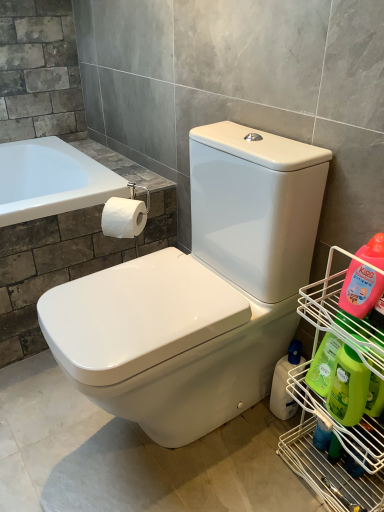
Identify the location of white matte toilet paper at upper left. This screenshot has height=512, width=384. (123, 217).

What do you see at coordinates (285, 382) in the screenshot? I see `translucent plastic bottle at lower right, which is the 1th cleaning product in back-to-front order` at bounding box center [285, 382].

Measure the distance between green plastic bottle at right, arranged as the third cleaning product when viewed from the front, and camera.

green plastic bottle at right, arranged as the third cleaning product when viewed from the front, and camera are 35.65 inches apart.

You are a GUI agent. You are given a task and a screenshot of the screen. Output one action in this format:
    pyautogui.click(x=<x>, y=<y>)
    Task: Click on the pink plastic bottle at right, the fourth cleaning product positioned from the back
    Image resolution: width=384 pixels, height=512 pixels.
    Given the screenshot: What is the action you would take?
    pyautogui.click(x=360, y=289)

Find the location of `metal wire rack at right`. metal wire rack at right is located at coordinates (326, 456).

Locate an element on the screen. This screenshot has height=512, width=384. green matte bottle at lower right, which is counted as the 2th cleaning product, starting from the front is located at coordinates (348, 387).

From the picture: Who is shorter, green matte bottle at lower right, the 3th cleaning product positioned from the back, or white matte toilet paper at upper left?

With less height is white matte toilet paper at upper left.

Which of these two, green matte bottle at lower right, which is counted as the 2th cleaning product, starting from the front, or white matte toilet paper at upper left, is wider?

Wider between the two is white matte toilet paper at upper left.

Which is more to the left, green matte bottle at lower right, which is counted as the 2th cleaning product, starting from the front, or white matte toilet paper at upper left?

From the viewer's perspective, white matte toilet paper at upper left appears more on the left side.

From a real-world perspective, does green matte bottle at lower right, which is counted as the 2th cleaning product, starting from the front, sit lower than white matte toilet paper at upper left?

Yes, from a real-world perspective, green matte bottle at lower right, which is counted as the 2th cleaning product, starting from the front, is below white matte toilet paper at upper left.

From the image's perspective, relative to white matte toilet paper at upper left, is translucent plastic bottle at lower right, the 4th cleaning product from the front, above or below?

translucent plastic bottle at lower right, the 4th cleaning product from the front, is situated lower than white matte toilet paper at upper left in the image.

From a real-world perspective, which is physically above, translucent plastic bottle at lower right, the 4th cleaning product from the front, or white matte toilet paper at upper left?

From a 3D spatial view, white matte toilet paper at upper left is above.

Is white matte toilet paper at upper left a part of translucent plastic bottle at lower right, which is the 1th cleaning product in back-to-front order?

That's incorrect, white matte toilet paper at upper left is not inside translucent plastic bottle at lower right, which is the 1th cleaning product in back-to-front order.

Are translucent plastic bottle at lower right, which is the 1th cleaning product in back-to-front order, and white matte toilet paper at upper left far apart?

Actually, translucent plastic bottle at lower right, which is the 1th cleaning product in back-to-front order, and white matte toilet paper at upper left are a little close together.

What's the angular difference between green matte bottle at lower right, which is counted as the 2th cleaning product, starting from the front, and pink plastic bottle at right, acting as the 1th cleaning product starting from the front,'s facing directions?

3.24 degrees.

Which is closer to the camera, [363,385] or [351,307]?

Clearly, point [363,385] is closer to the camera than point [351,307].

Measure the distance between green matte bottle at lower right, the 3th cleaning product positioned from the back, and pink plastic bottle at right, the fourth cleaning product positioned from the back.

green matte bottle at lower right, the 3th cleaning product positioned from the back, and pink plastic bottle at right, the fourth cleaning product positioned from the back, are 16.16 centimeters apart.

Consider the image. Relative to pink plastic bottle at right, the fourth cleaning product positioned from the back, is green matte bottle at lower right, the 3th cleaning product positioned from the back, in front or behind?

In the image, green matte bottle at lower right, the 3th cleaning product positioned from the back, appears behind pink plastic bottle at right, the fourth cleaning product positioned from the back.

What's the angular difference between metal wire rack at right and green plastic bottle at right, arranged as the third cleaning product when viewed from the front,'s facing directions?

They differ by 0.923 degrees in their facing directions.

Is metal wire rack at right at the right side of green plastic bottle at right, arranged as the third cleaning product when viewed from the front?

Yes, metal wire rack at right is to the right of green plastic bottle at right, arranged as the third cleaning product when viewed from the front.

The height and width of the screenshot is (512, 384). Find the location of `shelf lying in front of the green plastic bottle at right, arranged as the third cleaning product when viewed from the front`. shelf lying in front of the green plastic bottle at right, arranged as the third cleaning product when viewed from the front is located at coordinates (326, 456).

Is metal wire rack at right bigger than green plastic bottle at right, arranged as the third cleaning product when viewed from the front?

Yes.

Where is `cleaning product above the green plastic bottle at right, arranged as the third cleaning product when viewed from the front (from the image's perspective)`? The width and height of the screenshot is (384, 512). cleaning product above the green plastic bottle at right, arranged as the third cleaning product when viewed from the front (from the image's perspective) is located at coordinates (360, 289).

Between pink plastic bottle at right, acting as the 1th cleaning product starting from the front, and green plastic bottle at right, arranged as the 2th cleaning product when viewed from the back, which one has larger width?

Wider between the two is green plastic bottle at right, arranged as the 2th cleaning product when viewed from the back.

Looking at this image, is pink plastic bottle at right, acting as the 1th cleaning product starting from the front, at the right side of green plastic bottle at right, arranged as the third cleaning product when viewed from the front?

Yes, pink plastic bottle at right, acting as the 1th cleaning product starting from the front, is to the right of green plastic bottle at right, arranged as the third cleaning product when viewed from the front.

Is green matte bottle at lower right, which is counted as the 2th cleaning product, starting from the front, spatially inside metal wire rack at right, or outside of it?

green matte bottle at lower right, which is counted as the 2th cleaning product, starting from the front, is contained in metal wire rack at right.

Does green matte bottle at lower right, the 3th cleaning product positioned from the back, have a lesser height compared to metal wire rack at right?

Yes, green matte bottle at lower right, the 3th cleaning product positioned from the back, is shorter than metal wire rack at right.

Could you measure the distance between green matte bottle at lower right, which is counted as the 2th cleaning product, starting from the front, and metal wire rack at right?

4.45 inches.

Is green matte bottle at lower right, the 3th cleaning product positioned from the back, facing towards metal wire rack at right?

Yes, green matte bottle at lower right, the 3th cleaning product positioned from the back, faces towards metal wire rack at right.

Is green matte bottle at lower right, the 3th cleaning product positioned from the back, bigger or smaller than green plastic bottle at right, arranged as the third cleaning product when viewed from the front?

Clearly, green matte bottle at lower right, the 3th cleaning product positioned from the back, is larger in size than green plastic bottle at right, arranged as the third cleaning product when viewed from the front.

Considering the sizes of green matte bottle at lower right, the 3th cleaning product positioned from the back, and green plastic bottle at right, arranged as the 2th cleaning product when viewed from the back, in the image, is green matte bottle at lower right, the 3th cleaning product positioned from the back, wider or thinner than green plastic bottle at right, arranged as the 2th cleaning product when viewed from the back,?

green matte bottle at lower right, the 3th cleaning product positioned from the back, is wider than green plastic bottle at right, arranged as the 2th cleaning product when viewed from the back.

Does point (353, 383) lie in front of point (313, 369)?

Yes, point (353, 383) is closer to viewer.

Consider the image. In the image, is green matte bottle at lower right, the 3th cleaning product positioned from the back, on the left side or the right side of green plastic bottle at right, arranged as the 2th cleaning product when viewed from the back?

Clearly, green matte bottle at lower right, the 3th cleaning product positioned from the back, is on the right of green plastic bottle at right, arranged as the 2th cleaning product when viewed from the back, in the image.

Locate an element on the screen. cleaning product that is the 1st object directly below the white matte toilet paper at upper left (from a real-world perspective) is located at coordinates (348, 387).

Identify the location of toilet paper to the left of translucent plastic bottle at lower right, the 4th cleaning product from the front. (123, 217).

Based on their spatial positions, is green matte bottle at lower right, the 3th cleaning product positioned from the back, or white matte toilet paper at upper left further from translucent plastic bottle at lower right, the 4th cleaning product from the front?

The object further to translucent plastic bottle at lower right, the 4th cleaning product from the front, is white matte toilet paper at upper left.

Estimate the real-world distances between objects in this image. Which object is closer to green matte bottle at lower right, the 3th cleaning product positioned from the back, white matte toilet paper at upper left or translucent plastic bottle at lower right, which is the 1th cleaning product in back-to-front order?

Among the two, translucent plastic bottle at lower right, which is the 1th cleaning product in back-to-front order, is located nearer to green matte bottle at lower right, the 3th cleaning product positioned from the back.

Considering their positions, is pink plastic bottle at right, acting as the 1th cleaning product starting from the front, positioned further to metal wire rack at right than white matte toilet paper at upper left?

white matte toilet paper at upper left is further to metal wire rack at right.

When comparing their distances from white matte toilet paper at upper left, does pink plastic bottle at right, the fourth cleaning product positioned from the back, or metal wire rack at right seem further?

metal wire rack at right is positioned further to the anchor white matte toilet paper at upper left.

Considering their positions, is translucent plastic bottle at lower right, which is the 1th cleaning product in back-to-front order, positioned closer to white matte toilet paper at upper left than metal wire rack at right?

Among the two, translucent plastic bottle at lower right, which is the 1th cleaning product in back-to-front order, is located nearer to white matte toilet paper at upper left.

When comparing their distances from green plastic bottle at right, arranged as the 2th cleaning product when viewed from the back, does translucent plastic bottle at lower right, the 4th cleaning product from the front, or metal wire rack at right seem further?

Among the two, translucent plastic bottle at lower right, the 4th cleaning product from the front, is located further to green plastic bottle at right, arranged as the 2th cleaning product when viewed from the back.

Considering their positions, is green matte bottle at lower right, the 3th cleaning product positioned from the back, positioned further to pink plastic bottle at right, the fourth cleaning product positioned from the back, than green plastic bottle at right, arranged as the third cleaning product when viewed from the front?

The object further to pink plastic bottle at right, the fourth cleaning product positioned from the back, is green matte bottle at lower right, the 3th cleaning product positioned from the back.

Estimate the real-world distances between objects in this image. Which object is further from green plastic bottle at right, arranged as the third cleaning product when viewed from the front, green matte bottle at lower right, the 3th cleaning product positioned from the back, or pink plastic bottle at right, the fourth cleaning product positioned from the back?

The object further to green plastic bottle at right, arranged as the third cleaning product when viewed from the front, is pink plastic bottle at right, the fourth cleaning product positioned from the back.

This screenshot has height=512, width=384. In order to click on cleaning product between pink plastic bottle at right, the fourth cleaning product positioned from the back, and green matte bottle at lower right, which is counted as the 2th cleaning product, starting from the front, from top to bottom in this screenshot , I will do `click(323, 365)`.

What are the coordinates of `cleaning product between white matte toilet paper at upper left and green plastic bottle at right, arranged as the 2th cleaning product when viewed from the back, from left to right` in the screenshot? It's located at (285, 382).

This screenshot has width=384, height=512. I want to click on cleaning product between green matte bottle at lower right, which is counted as the 2th cleaning product, starting from the front, and translucent plastic bottle at lower right, which is the 1th cleaning product in back-to-front order, from front to back, so click(323, 365).